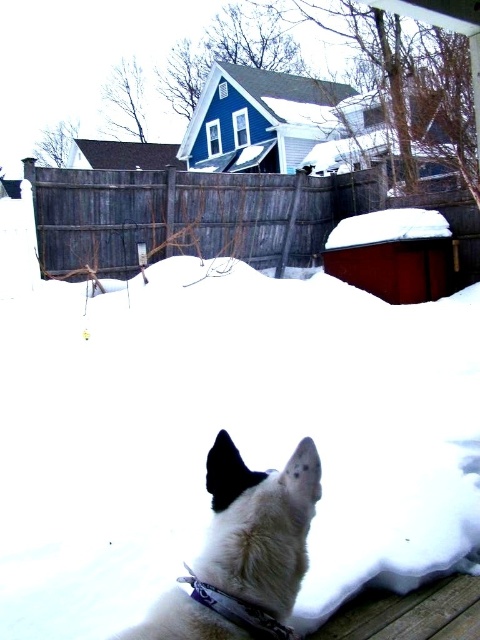
Does white fluffy snow at center have a greater height compared to white matte dog at lower center?

In fact, white fluffy snow at center may be shorter than white matte dog at lower center.

Who is more distant from viewer, (x=130, y=598) or (x=296, y=544)?

Point (x=130, y=598)

Where is `white fluffy snow at center`? Image resolution: width=480 pixels, height=640 pixels. white fluffy snow at center is located at coordinates (229, 433).

Can you confirm if wooden at lower right is smaller than purple fabric neckband at lower center?

No.

Image resolution: width=480 pixels, height=640 pixels. Describe the element at coordinates (407, 612) in the screenshot. I see `wooden at lower right` at that location.

Image resolution: width=480 pixels, height=640 pixels. I want to click on wooden at lower right, so click(407, 612).

Between white fluffy snow at center and wooden at lower right, which one appears on the right side from the viewer's perspective?

Positioned to the right is white fluffy snow at center.

Who is higher up, white fluffy snow at center or wooden at lower right?

white fluffy snow at center is above.

Is point (468, 490) positioned behind point (468, 637)?

Yes, it is.

The image size is (480, 640). Find the location of `white fluffy snow at center`. white fluffy snow at center is located at coordinates (229, 433).